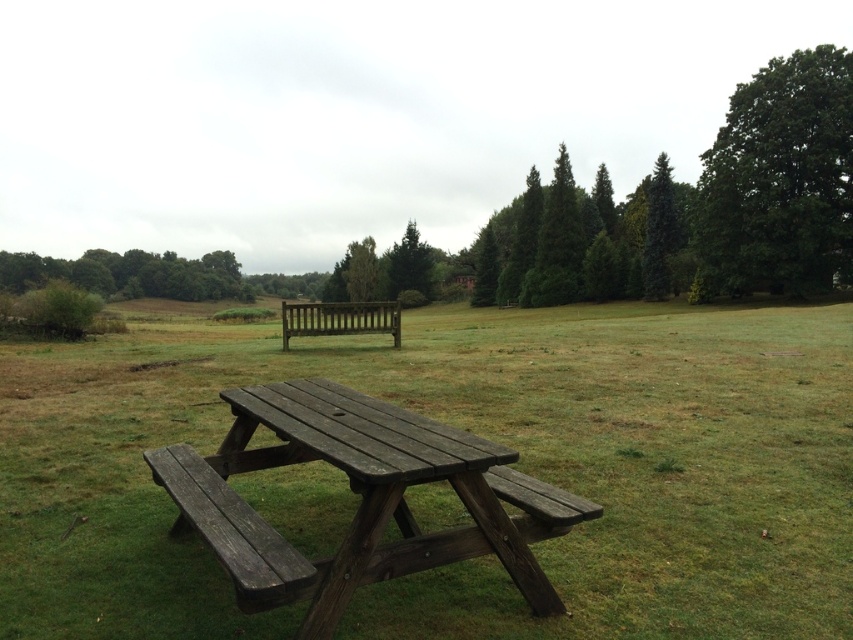
Which is more to the right, brown wooden picnic table at center or green textured trees at upper center?

green textured trees at upper center

Between point (753, 632) and point (556, 275), which one is positioned in front?

Positioned in front is point (753, 632).

Image resolution: width=853 pixels, height=640 pixels. Find the location of `brown wooden picnic table at center`. brown wooden picnic table at center is located at coordinates (480, 435).

Where is `brown wooden picnic table at center`? brown wooden picnic table at center is located at coordinates (480, 435).

Which is more to the left, green leafy tree at upper right or wooden bench at center?

From the viewer's perspective, wooden bench at center appears more on the left side.

Can you confirm if green leafy tree at upper right is smaller than wooden bench at center?

No.

This screenshot has height=640, width=853. What do you see at coordinates (780, 179) in the screenshot?
I see `green leafy tree at upper right` at bounding box center [780, 179].

The height and width of the screenshot is (640, 853). What are the coordinates of `green leafy tree at upper right` in the screenshot? It's located at (780, 179).

Who is positioned more to the left, green leafy tree at upper right or green matte tree at upper right?

green matte tree at upper right is more to the left.

Which is in front, point (701, 166) or point (674, 202)?

Positioned in front is point (701, 166).

Find the location of a particular element. This screenshot has width=853, height=640. green leafy tree at upper right is located at coordinates (780, 179).